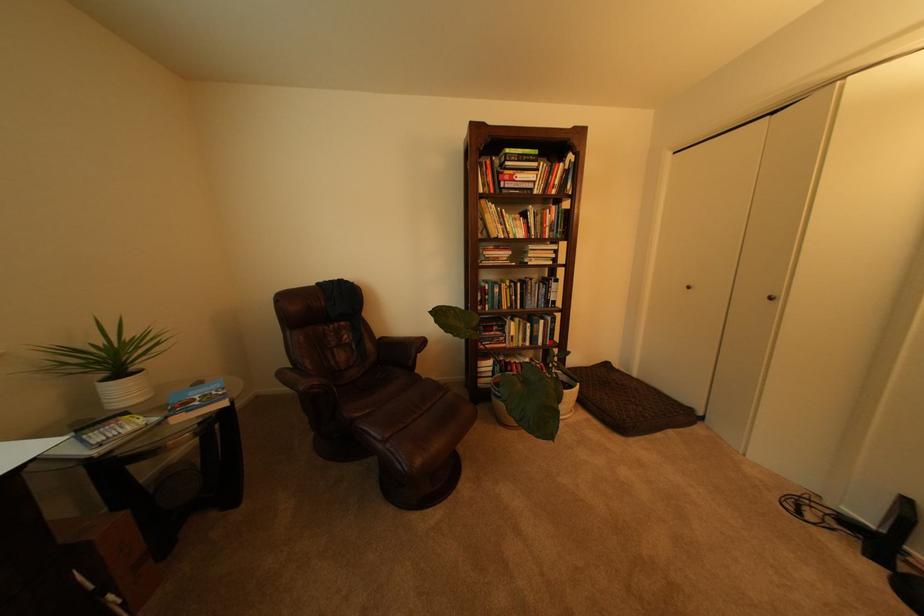
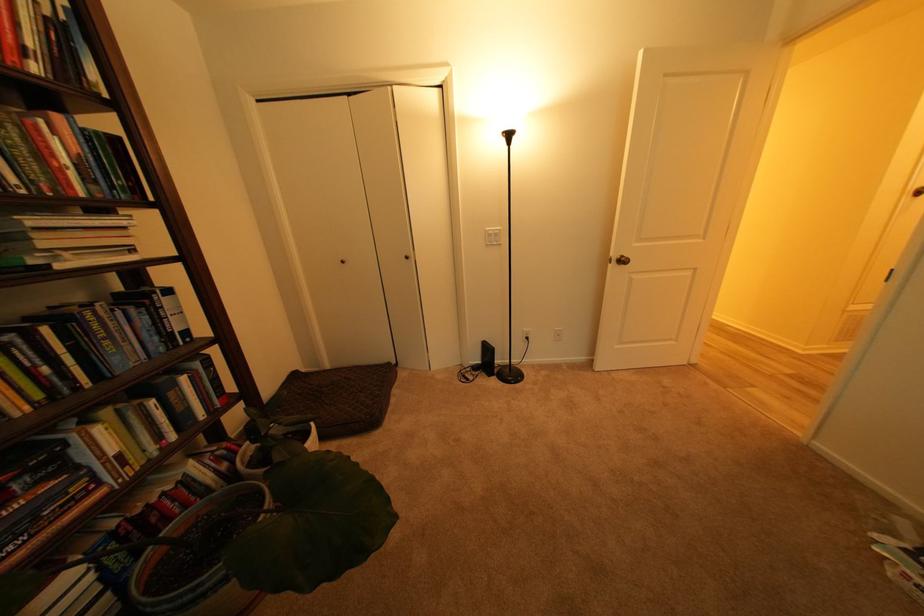
The point at (646, 377) is marked in the first image. Where is the corresponding point in the second image?

(338, 368)